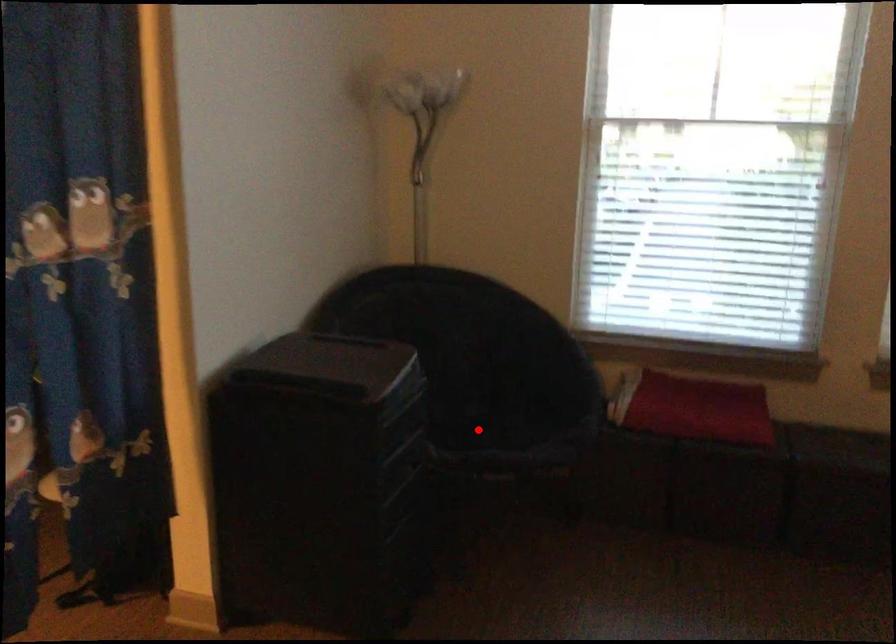
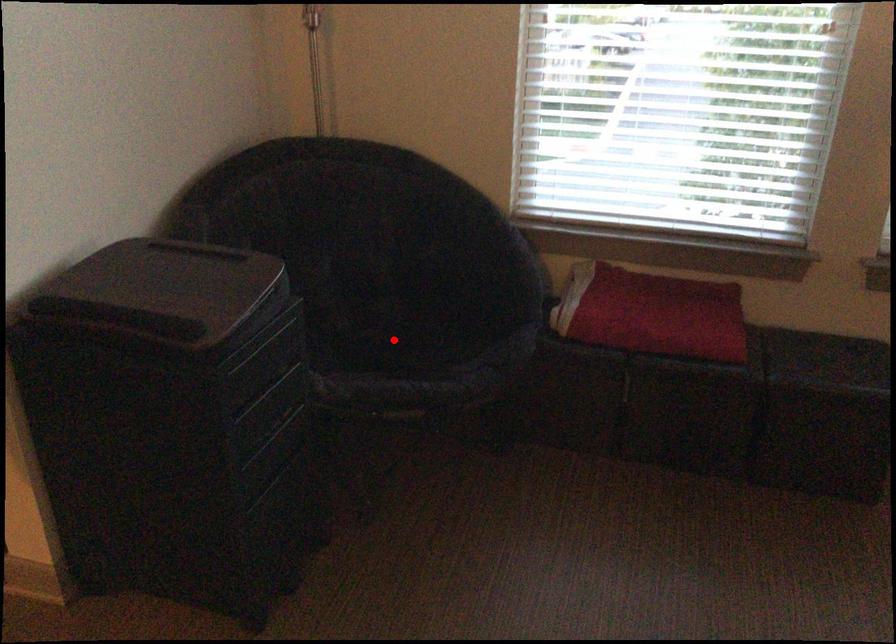
I am providing you with two images of the same scene from different viewpoints. A red point is marked on the first image and another point is marked on the second image. Is the red point in image1 aligned with the point shown in image2?

Yes